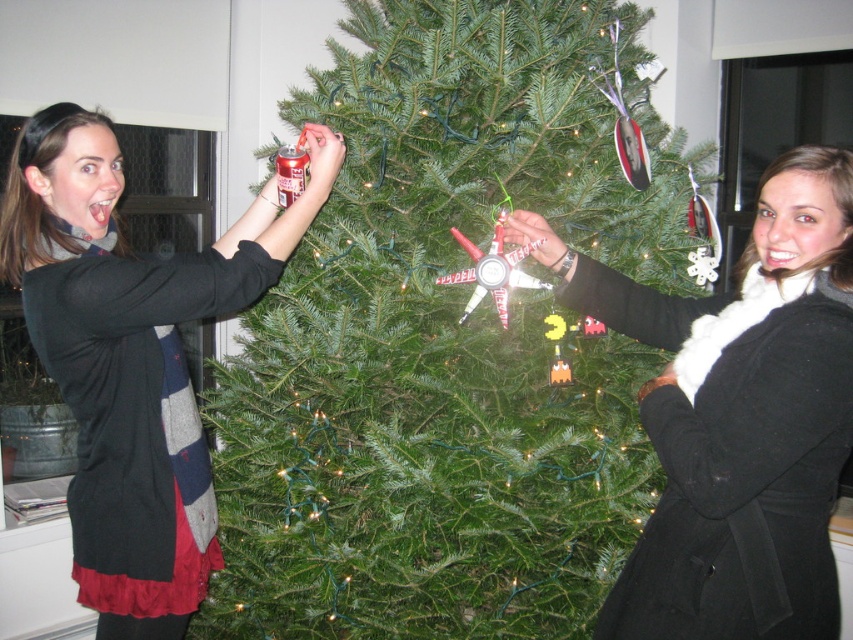
Question: Which is nearer to the green matte christmas tree at center?

Choices:
 (A) white fur scarf at upper right
 (B) matte black sweater at left

Answer: (B)

Question: Estimate the real-world distances between objects in this image. Which object is closer to the white fur scarf at upper right?

Choices:
 (A) matte black sweater at left
 (B) green matte christmas tree at center

Answer: (B)

Question: Among these points, which one is nearest to the camera?

Choices:
 (A) (341, 474)
 (B) (646, 291)

Answer: (B)

Question: Can you confirm if green matte christmas tree at center is bigger than matte black sweater at left?

Choices:
 (A) no
 (B) yes

Answer: (B)

Question: Does green matte christmas tree at center come in front of matte black sweater at left?

Choices:
 (A) no
 (B) yes

Answer: (A)

Question: Is white fur scarf at upper right below matte black sweater at left?

Choices:
 (A) no
 (B) yes

Answer: (B)